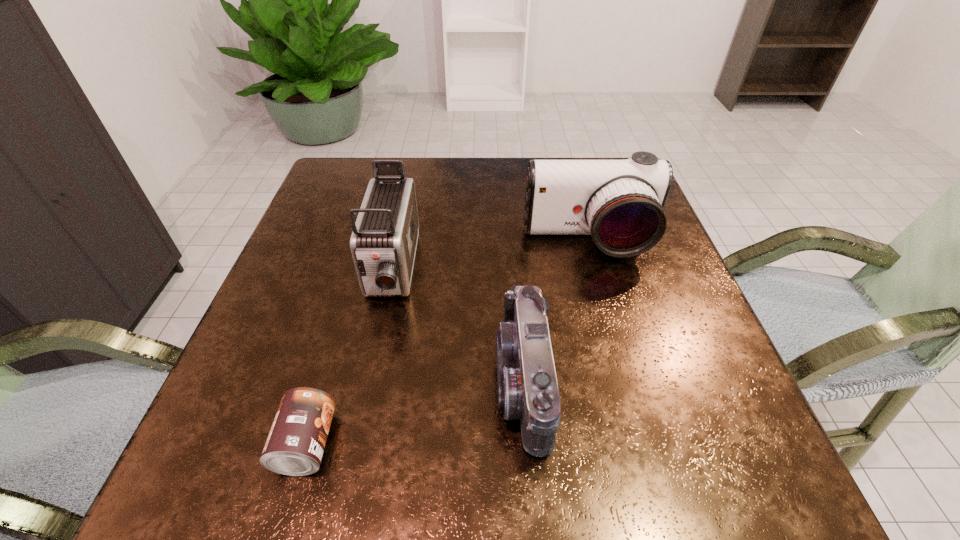
You are a GUI agent. You are given a task and a screenshot of the screen. Output one action in this format:
    pyautogui.click(x=<x>, y=<y>)
    Task: Click on the leftmost camcorder
    
    Given the screenshot: What is the action you would take?
    pyautogui.click(x=383, y=243)

Identify the location of the shortest camcorder. (528, 390).

Locate an element on the screen. This screenshot has height=540, width=960. the nearest camcorder is located at coordinates [x=528, y=390].

Locate an element on the screen. The image size is (960, 540). can is located at coordinates pyautogui.click(x=295, y=445).

Where is `vacant space located 0.210m at the lens of the leftmost camcorder`? vacant space located 0.210m at the lens of the leftmost camcorder is located at coordinates (360, 419).

Image resolution: width=960 pixels, height=540 pixels. What are the coordinates of `vacant space located 0.330m on the front-facing side of the nearest camcorder` in the screenshot? It's located at (299, 382).

Where is `vacant area situated 0.370m on the front-facing side of the nearest camcorder`? This screenshot has height=540, width=960. vacant area situated 0.370m on the front-facing side of the nearest camcorder is located at coordinates (275, 382).

Find the location of a particular element. Image resolution: width=960 pixels, height=540 pixels. free region located 0.400m on the front-facing side of the nearest camcorder is located at coordinates (257, 382).

Image resolution: width=960 pixels, height=540 pixels. What are the coordinates of `vacant space located on the front label of the can` in the screenshot? It's located at (487, 444).

You are a GUI agent. You are given a task and a screenshot of the screen. Output one action in this format:
    pyautogui.click(x=<x>, y=<y>)
    Task: Click on the camcorder located in the near edge section of the desktop
    
    Given the screenshot: What is the action you would take?
    pyautogui.click(x=528, y=390)